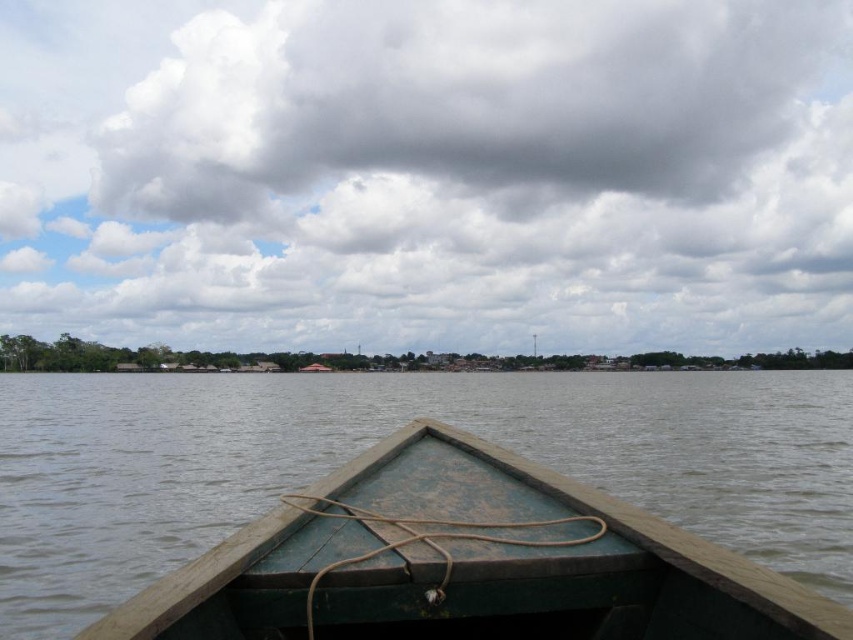
You are an architect designing a model of this scene. You need to ensure that the cloudy sky at upper center and the green weathered wood boat at center are scaled correctly. Which object should be made wider in the model to maintain accuracy?

The cloudy sky at upper center should be made wider in the model because its width is larger than the green weathered wood boat at center according to the description.

You are an observer sitting at the bow of the boat. You notice the cloudy sky at upper center and the green weathered wood boat at center. Which object is positioned to the left when looking straight ahead?

The cloudy sky at upper center is positioned to the left of the green weathered wood boat at center.

You are sitting at the bow of the boat and want to point out two specific points on the boat. The first point is at coordinates point (173, 97) and the second is at point (662, 637). Which point is closer to you?

Point (173, 97) is closer to you because it is further to the camera than point (662, 637).